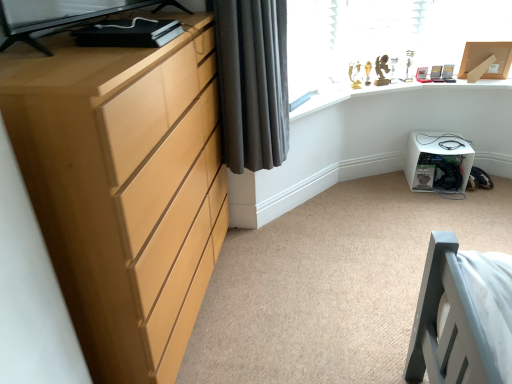
Question: Visually, is gold metallic trophy case at upper right positioned to the left or to the right of white plastic storage box at lower right?

Choices:
 (A) left
 (B) right

Answer: (A)

Question: Does point (342, 97) appear closer or farther from the camera than point (412, 162)?

Choices:
 (A) closer
 (B) farther

Answer: (A)

Question: Which is farther from the white plastic storage box at lower right?

Choices:
 (A) dark grey fabric curtain at upper left
 (B) light wood chest of drawers at left
 (C) gold metallic trophy case at upper right

Answer: (B)

Question: Which object is positioned closest to the dark grey fabric curtain at upper left?

Choices:
 (A) gold metallic trophy case at upper right
 (B) light wood chest of drawers at left
 (C) white plastic storage box at lower right

Answer: (B)